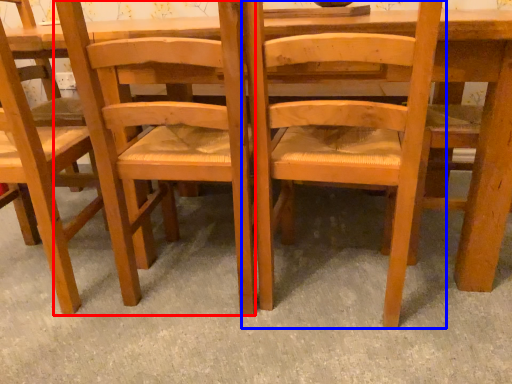
Question: Among these objects, which one is nearest to the camera, chair (highlighted by a red box) or chair (highlighted by a blue box)?

Choices:
 (A) chair
 (B) chair

Answer: (B)